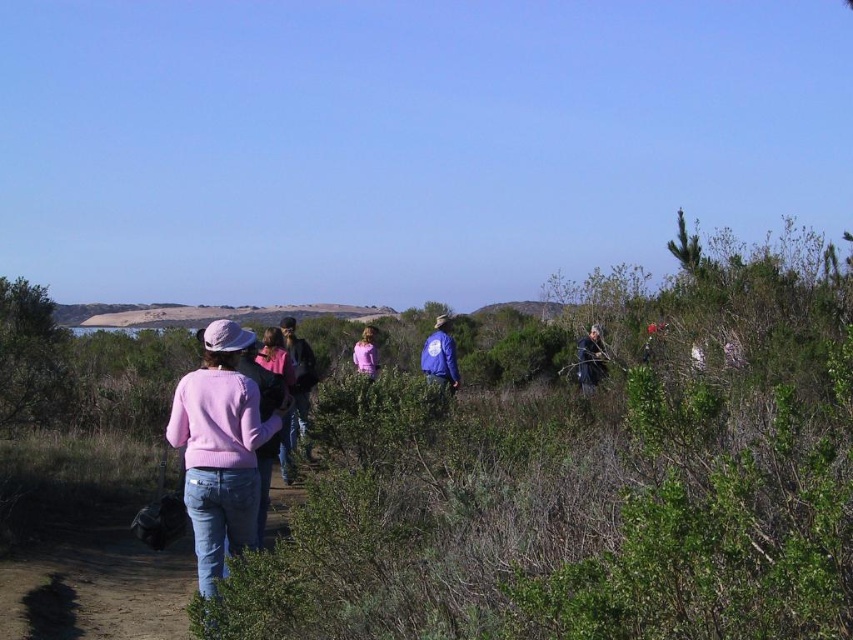
Question: Does pink sweater at center lie behind pink fabric shirt at center?

Choices:
 (A) yes
 (B) no

Answer: (B)

Question: Is pink sweater at center to the right of dark brown leather jacket at right from the viewer's perspective?

Choices:
 (A) no
 (B) yes

Answer: (A)

Question: Which of these objects is positioned farthest from the pink sweater at center?

Choices:
 (A) blue fabric jacket at center
 (B) dark brown leather jacket at right

Answer: (B)

Question: Is pink sweater at center to the right of blue fabric jacket at center from the viewer's perspective?

Choices:
 (A) no
 (B) yes

Answer: (A)

Question: Which object is positioned closest to the pink sweater at center?

Choices:
 (A) blue fabric jacket at center
 (B) dark brown leather jacket at right
 (C) pink fabric shirt at center

Answer: (C)

Question: Which is farther from the pink fabric shirt at center?

Choices:
 (A) dark brown leather jacket at right
 (B) pink sweater at center

Answer: (A)